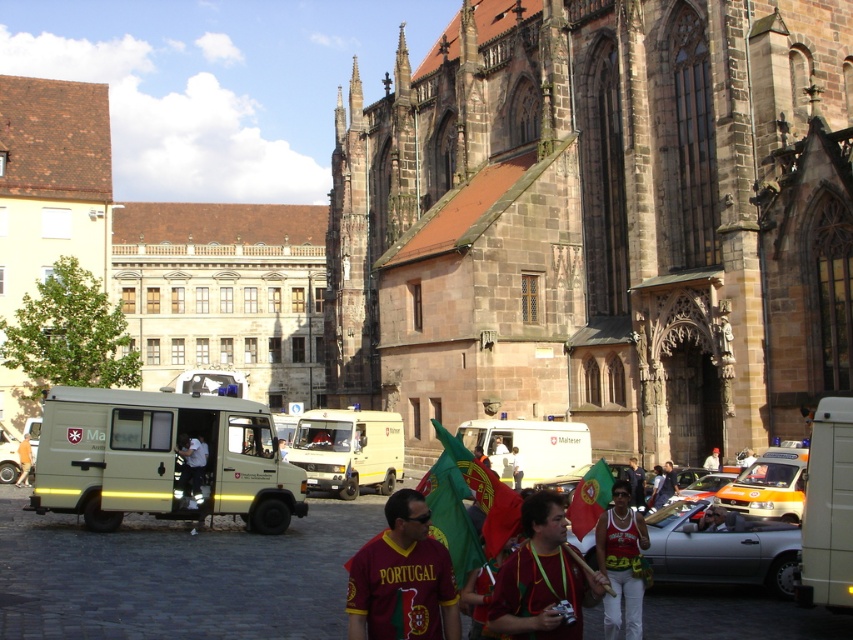
Question: Can you confirm if dark brown stone church at center is positioned above orange cotton shirt at center?

Choices:
 (A) no
 (B) yes

Answer: (B)

Question: Which point is farther to the camera?

Choices:
 (A) (x=575, y=436)
 (B) (x=26, y=449)
 (C) (x=637, y=637)
 (D) (x=572, y=580)

Answer: (B)

Question: Does matte white van at center have a lesser width compared to light beige fabric uniform at center?

Choices:
 (A) no
 (B) yes

Answer: (A)

Question: Considering the real-world distances, which object is farthest from the white matte ambulance at center?

Choices:
 (A) beige matte ambulance at center-left
 (B) orange cotton shirt at center
 (C) matte black jacket at center

Answer: (B)

Question: Is dark brown stone church at center positioned before matte black shirt at center?

Choices:
 (A) no
 (B) yes

Answer: (A)

Question: Which point is closer to the camera?

Choices:
 (A) yellow matte ambulance at center-right
 (B) white matte ambulance at center

Answer: (A)